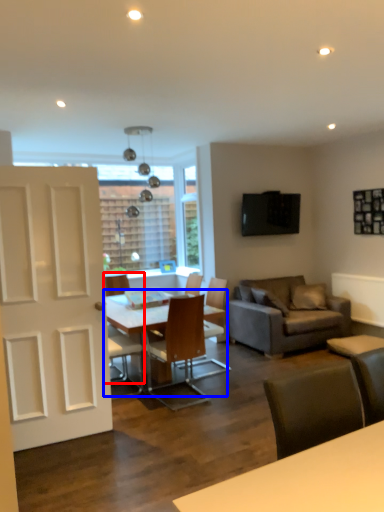
Question: Which of the following is the closest to the observer, chair (highlighted by a red box) or table (highlighted by a blue box)?

Choices:
 (A) chair
 (B) table

Answer: (B)